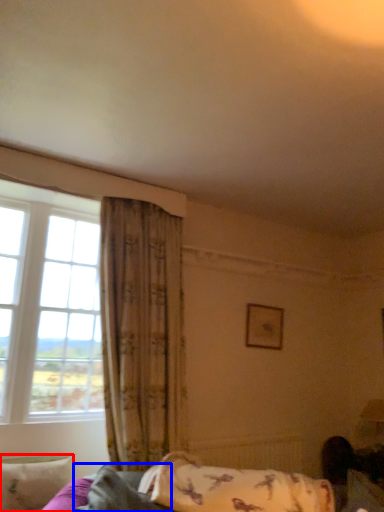
Question: Which object appears closest to the camera in this image, pillow (highlighted by a red box) or pillow (highlighted by a blue box)?

Choices:
 (A) pillow
 (B) pillow

Answer: (B)